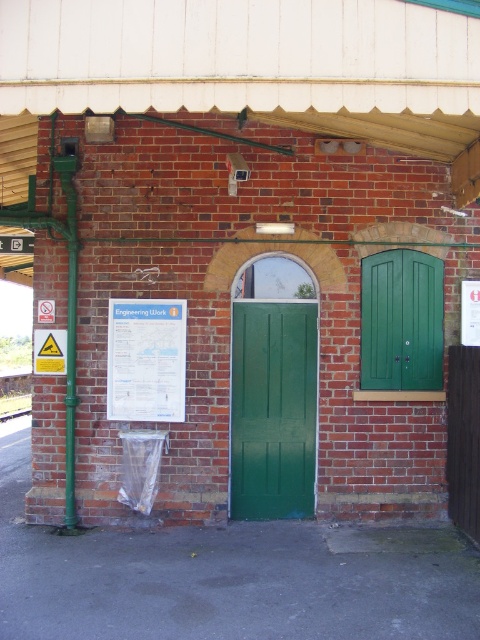
Who is more forward, (x=257, y=442) or (x=23, y=412)?

Point (x=257, y=442) is in front.

Is green matte door at center below metal train track at lower left?

No.

Does point (264, 352) come closer to viewer compared to point (0, 413)?

That is True.

The width and height of the screenshot is (480, 640). In order to click on green matte door at center in this screenshot , I will do `click(273, 410)`.

Is green matte door at center below green wooden door at right?

Indeed, green matte door at center is positioned under green wooden door at right.

Which is behind, point (292, 353) or point (420, 374)?

The point (292, 353) is more distant.

This screenshot has height=640, width=480. Find the location of `green matte door at center`. green matte door at center is located at coordinates (273, 410).

Between green wooden door at right and metal train track at lower left, which one appears on the right side from the viewer's perspective?

From the viewer's perspective, green wooden door at right appears more on the right side.

Can you confirm if green wooden door at right is positioned to the right of metal train track at lower left?

Indeed, green wooden door at right is positioned on the right side of metal train track at lower left.

This screenshot has height=640, width=480. Describe the element at coordinates (402, 321) in the screenshot. I see `green wooden door at right` at that location.

This screenshot has width=480, height=640. What are the coordinates of `green wooden door at right` in the screenshot? It's located at (402, 321).